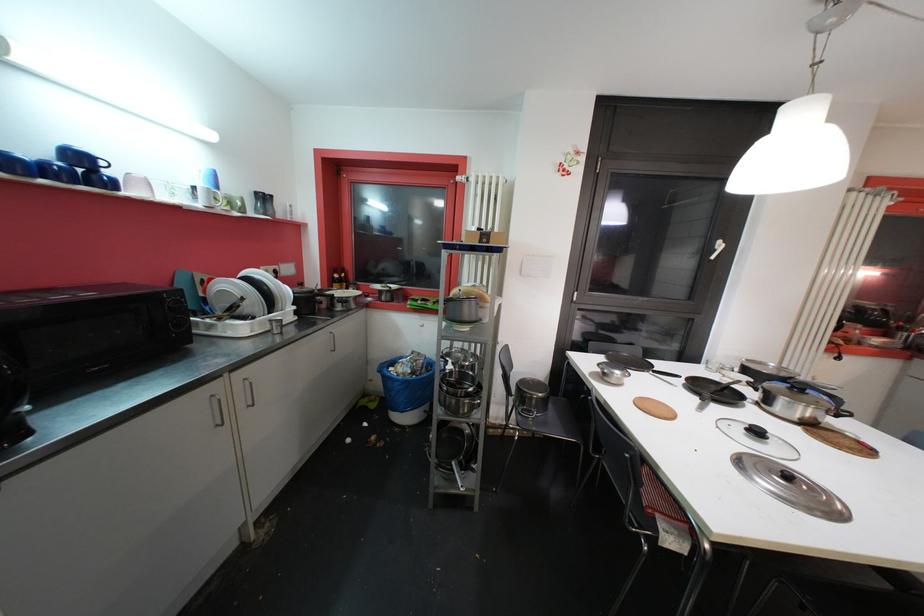
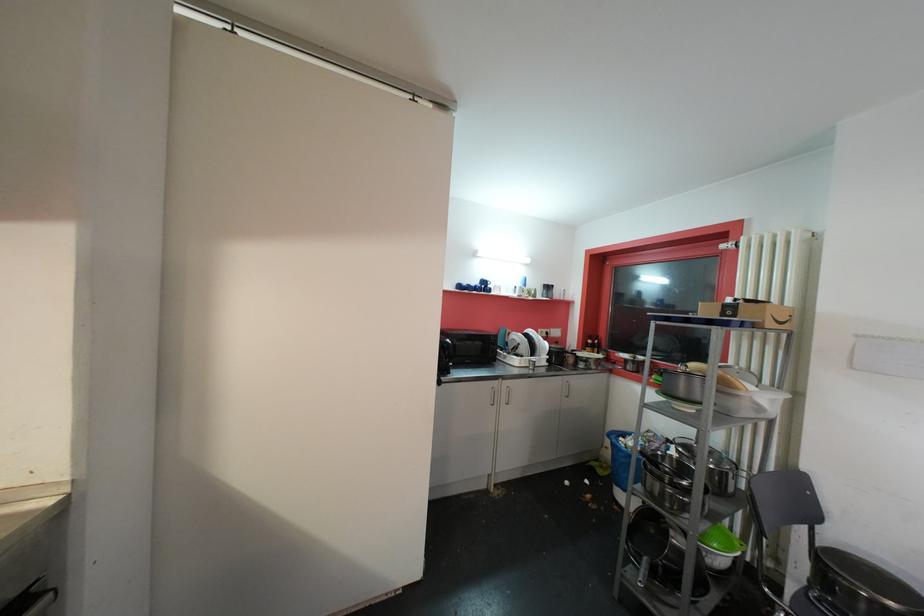
Where in the second image is the point corresponding to (86,161) from the first image?

(489, 285)